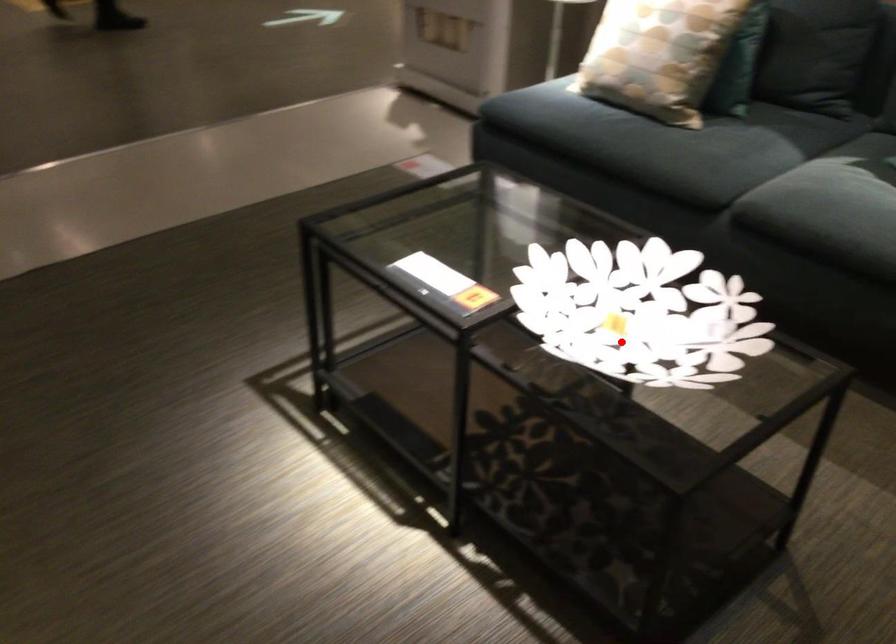
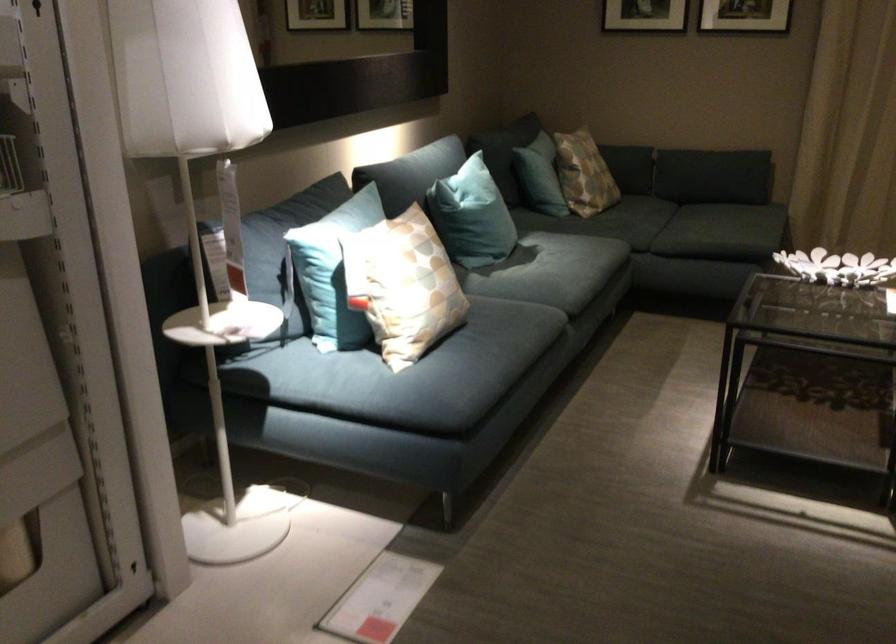
Locate, in the second image, the point that corresponds to the highlighted location in the first image.

(837, 267)